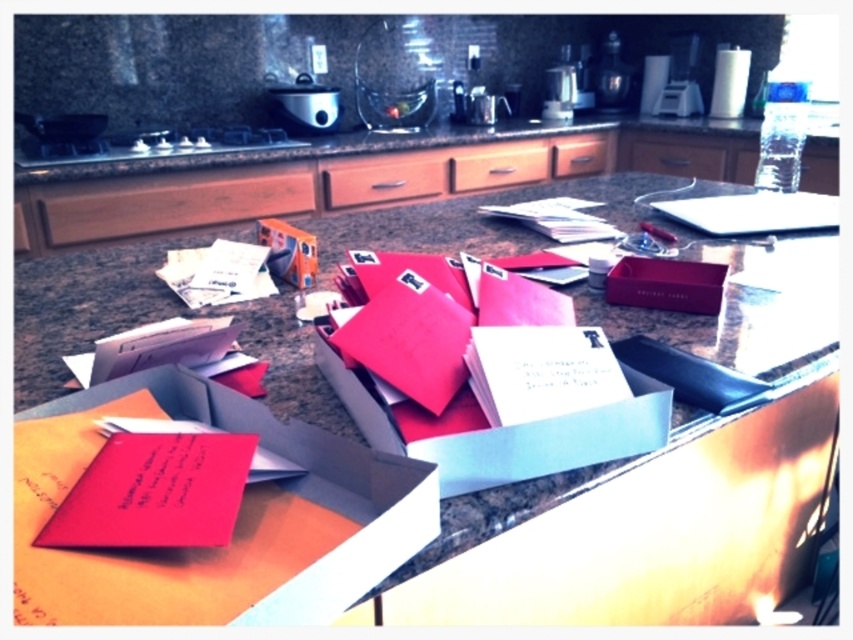
Who is lower down, matte paper envelope at center or matte cardboard box at center?

matte cardboard box at center is lower down.

Between matte paper envelope at center and matte cardboard box at center, which one has more height?

matte paper envelope at center is taller.

Is point (380, 237) less distant than point (631, 372)?

That is False.

You are a GUI agent. You are given a task and a screenshot of the screen. Output one action in this format:
    pyautogui.click(x=<x>, y=<y>)
    Task: Click on the matte paper envelope at center
    The width and height of the screenshot is (853, 640).
    Given the screenshot: What is the action you would take?
    pyautogui.click(x=624, y=529)

Between matte paper box at center and matte cardboard box at center, which one is positioned higher?

matte cardboard box at center is higher up.

Between point (24, 522) and point (578, 458), which one is positioned in front?

Point (24, 522) is in front.

Is point (343, 554) closer to camera compared to point (457, 484)?

Yes, point (343, 554) is closer to viewer.

The height and width of the screenshot is (640, 853). Find the location of `matte paper box at center`. matte paper box at center is located at coordinates click(235, 524).

Does point (491, 586) lie behind point (50, 566)?

Yes.

Consider the image. Can you confirm if matte paper envelope at center is wider than matte paper box at center?

Correct, the width of matte paper envelope at center exceeds that of matte paper box at center.

The width and height of the screenshot is (853, 640). Find the location of `matte paper envelope at center`. matte paper envelope at center is located at coordinates (624, 529).